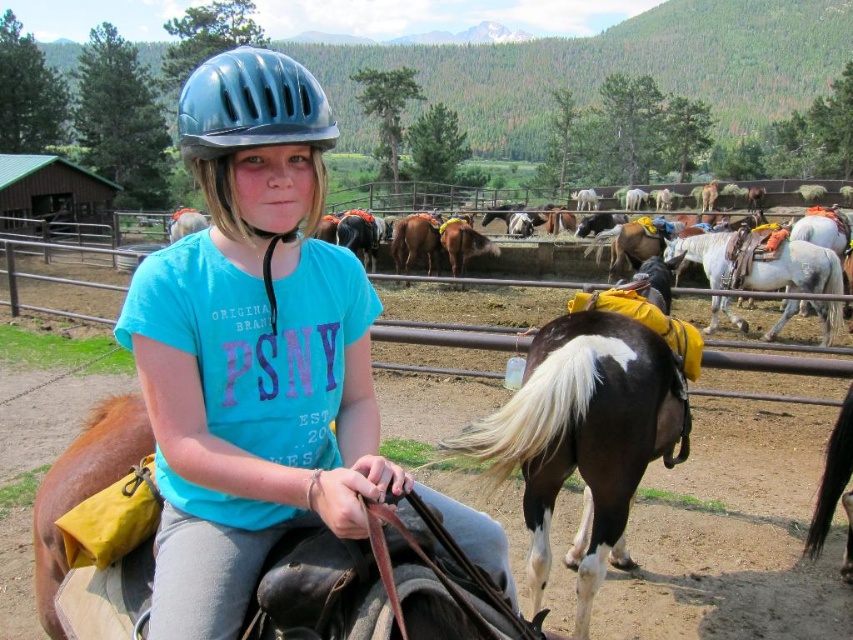
You are a photographer positioned to the left of the scene. You want to take a photo of the white glossy horse at center without the brown leather saddle at center appearing in the foreground. Is this possible based on their current positions?

The brown leather saddle at center is in front of the white glossy horse at center, so it will block the view. Move to the right to position the saddle behind the horse.

Based on the photo, you are a photographer standing at the center of the image. You want to take a photo of the brown leather saddle at center. Where should you point your camera to capture it?

You should point your camera towards the coordinates point (106, 541) to capture the brown leather saddle at center.

You are a photographer positioned at the center of the image. You want to capture a closeup shot of the matte blue helmet at upper center without including any of the other horses in the midground. Based on the spatial information provided, is this possible?

The matte blue helmet at upper center is located at point (250,124), which is within the upper center area of the image. Since the other horses are in the midground, their positions are likely further away or lower in the frame, making it possible to zoom in on the helmet without including them.